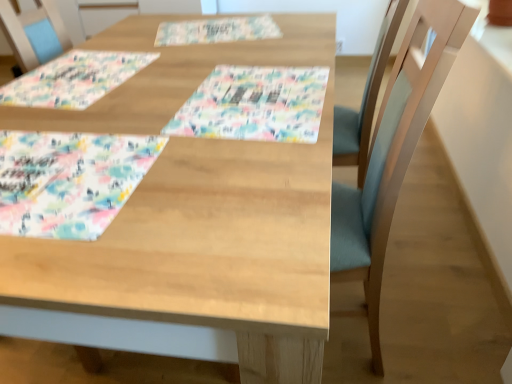
The image size is (512, 384). Find the location of `pastel floral fabric placemat at upper left, acting as the 2th place mat starting from the front`. pastel floral fabric placemat at upper left, acting as the 2th place mat starting from the front is located at coordinates (74, 79).

Measure the distance between floral paper placemat at upper center, which is the first place mat from top to bottom, and camera.

The distance of floral paper placemat at upper center, which is the first place mat from top to bottom, from camera is 1.44 meters.

Measure the distance between point (274,115) and camera.

Point (274,115) and camera are 93.80 centimeters apart.

This screenshot has width=512, height=384. What are the coordinates of `wooden table at center` in the screenshot? It's located at (198, 213).

Relative to floral paper placemat at upper center, which is counted as the third place mat, starting from the front, is pastel floral fabric placemat at lower left, which is the 1th place mat in front-to-back order, in front or behind?

pastel floral fabric placemat at lower left, which is the 1th place mat in front-to-back order, is in front of floral paper placemat at upper center, which is counted as the third place mat, starting from the front.

From a real-world perspective, relative to floral paper placemat at upper center, which is the first place mat from top to bottom, is pastel floral fabric placemat at lower left, which is the 1th place mat from bottom to top, vertically above or below?

From a real-world perspective, pastel floral fabric placemat at lower left, which is the 1th place mat from bottom to top, is physically above floral paper placemat at upper center, which is the first place mat from top to bottom.

This screenshot has height=384, width=512. There is a pastel floral fabric placemat at lower left, which is the 1th place mat from bottom to top. In order to click on the 2nd place mat above it (from the image's perspective) in this screenshot , I will do `click(217, 30)`.

From a real-world perspective, which is physically below, floral paper placemat at upper center, which is counted as the 1th place mat, starting from the back, or wooden table at center?

wooden table at center.

Would you say floral paper placemat at upper center, which is the first place mat from top to bottom, is to the left or to the right of wooden table at center in the picture?

In the image, floral paper placemat at upper center, which is the first place mat from top to bottom, appears on the right side of wooden table at center.

From the image's perspective, which is above, floral paper placemat at upper center, which is counted as the third place mat, starting from the front, or wooden table at center?

floral paper placemat at upper center, which is counted as the third place mat, starting from the front.

Is floral paper placemat at upper center, which is counted as the 1th place mat, starting from the back, taller than pastel floral fabric placemat at lower left, which is the 1th place mat from bottom to top?

In fact, floral paper placemat at upper center, which is counted as the 1th place mat, starting from the back, may be shorter than pastel floral fabric placemat at lower left, which is the 1th place mat from bottom to top.

In the image, is floral paper placemat at upper center, which is counted as the 1th place mat, starting from the back, on the left side or the right side of pastel floral fabric placemat at lower left, which is the 1th place mat from bottom to top?

From the image, it's evident that floral paper placemat at upper center, which is counted as the 1th place mat, starting from the back, is to the right of pastel floral fabric placemat at lower left, which is the 1th place mat from bottom to top.

Is floral paper placemat at upper center, which is counted as the third place mat, starting from the front, turned away from pastel floral fabric placemat at lower left, which ranks as the 3th place mat in back-to-front order?

No, floral paper placemat at upper center, which is counted as the third place mat, starting from the front, is not facing away from pastel floral fabric placemat at lower left, which ranks as the 3th place mat in back-to-front order.

Considering the sizes of floral paper placemat at upper center, the 3th place mat from the bottom, and pastel floral fabric placemat at lower left, which ranks as the 3th place mat in back-to-front order, in the image, is floral paper placemat at upper center, the 3th place mat from the bottom, wider or thinner than pastel floral fabric placemat at lower left, which ranks as the 3th place mat in back-to-front order,?

Clearly, floral paper placemat at upper center, the 3th place mat from the bottom, has less width compared to pastel floral fabric placemat at lower left, which ranks as the 3th place mat in back-to-front order.

From a real-world perspective, which object stands above the other?

In real-world perspective, pastel floral fabric placemat at upper left, acting as the 2th place mat starting from the front, is above.

From the image's perspective, count 2nd place mats upward from the wooden table at center and point to it. Please provide its 2D coordinates.

[(74, 79)]

From their relative heights in the image, would you say wooden table at center is taller or shorter than pastel floral fabric placemat at upper left, which ranks as the second place mat in back-to-front order?

In the image, wooden table at center appears to be taller than pastel floral fabric placemat at upper left, which ranks as the second place mat in back-to-front order.

Considering the sizes of wooden table at center and pastel floral fabric placemat at upper left, which ranks as the second place mat in back-to-front order, in the image, is wooden table at center bigger or smaller than pastel floral fabric placemat at upper left, which ranks as the second place mat in back-to-front order,?

In the image, wooden table at center appears to be larger than pastel floral fabric placemat at upper left, which ranks as the second place mat in back-to-front order.

From the image's perspective, is pastel floral fabric placemat at upper left, which ranks as the second place mat in back-to-front order, above or below pastel floral fabric placemat at lower left, the 3th place mat from the top?

Based on their image positions, pastel floral fabric placemat at upper left, which ranks as the second place mat in back-to-front order, is located above pastel floral fabric placemat at lower left, the 3th place mat from the top.

Between pastel floral fabric placemat at upper left, marked as the second place mat in a top-to-bottom arrangement, and pastel floral fabric placemat at lower left, which is the 1th place mat from bottom to top, which one has larger width?

pastel floral fabric placemat at lower left, which is the 1th place mat from bottom to top.

Does pastel floral fabric placemat at upper left, the second place mat in the bottom-to-top sequence, turn towards pastel floral fabric placemat at lower left, the 3th place mat from the top?

Yes, pastel floral fabric placemat at upper left, the second place mat in the bottom-to-top sequence, is oriented towards pastel floral fabric placemat at lower left, the 3th place mat from the top.

Between pastel floral fabric placemat at upper left, which ranks as the second place mat in back-to-front order, and pastel floral fabric placemat at lower left, which is the 1th place mat in front-to-back order, which one has smaller size?

pastel floral fabric placemat at lower left, which is the 1th place mat in front-to-back order.

Could you tell me if pastel floral fabric placemat at lower left, which is the 1th place mat in front-to-back order, is facing wooden table at center?

Yes, pastel floral fabric placemat at lower left, which is the 1th place mat in front-to-back order, is facing wooden table at center.

Considering the points (40, 188) and (261, 342), which point is behind, point (40, 188) or point (261, 342)?

The point (40, 188) is farther from the camera.

From the image's perspective, which is above, pastel floral fabric placemat at lower left, which ranks as the 3th place mat in back-to-front order, or wooden table at center?

pastel floral fabric placemat at lower left, which ranks as the 3th place mat in back-to-front order, is shown above in the image.

Would you say wooden table at center is outside pastel floral fabric placemat at lower left, which is the 1th place mat from bottom to top?

Indeed, wooden table at center is completely outside pastel floral fabric placemat at lower left, which is the 1th place mat from bottom to top.

Find the location of a particular element. The image size is (512, 384). the 1st place mat above the wooden table at center (from the image's perspective) is located at coordinates (69, 181).

Considering the positions of point (247, 274) and point (96, 154), is point (247, 274) closer or farther from the camera than point (96, 154)?

Point (247, 274).

From the image's perspective, is wooden table at center located above or below pastel floral fabric placemat at lower left, which ranks as the 3th place mat in back-to-front order?

wooden table at center is below pastel floral fabric placemat at lower left, which ranks as the 3th place mat in back-to-front order.

The image size is (512, 384). I want to click on the 2nd place mat positioned below the floral paper placemat at upper center, the 3th place mat from the bottom (from the image's perspective), so click(x=69, y=181).

Starting from the wooden table at center, which place mat is the 3rd one behind? Please provide its 2D coordinates.

[(217, 30)]

Based on their spatial positions, is floral paper placemat at upper center, which is counted as the third place mat, starting from the front, or watercolor fabric placemat at center closer to pastel floral fabric placemat at upper left, the second place mat in the bottom-to-top sequence?

The object closer to pastel floral fabric placemat at upper left, the second place mat in the bottom-to-top sequence, is floral paper placemat at upper center, which is counted as the third place mat, starting from the front.

When comparing their distances from pastel floral fabric placemat at upper left, which ranks as the second place mat in back-to-front order, does pastel floral fabric placemat at lower left, which ranks as the 3th place mat in back-to-front order, or wooden table at center seem further?

pastel floral fabric placemat at lower left, which ranks as the 3th place mat in back-to-front order, lies further to pastel floral fabric placemat at upper left, which ranks as the second place mat in back-to-front order, than the other object.

Looking at the image, which one is located further to floral paper placemat at upper center, the 3th place mat from the bottom, watercolor fabric placemat at center or pastel floral fabric placemat at upper left, the second place mat in the bottom-to-top sequence?

The object further to floral paper placemat at upper center, the 3th place mat from the bottom, is watercolor fabric placemat at center.

Which object lies nearer to the anchor point pastel floral fabric placemat at lower left, which ranks as the 3th place mat in back-to-front order, watercolor fabric placemat at center or wooden table at center?

wooden table at center.

Based on their spatial positions, is pastel floral fabric placemat at upper left, marked as the second place mat in a top-to-bottom arrangement, or pastel floral fabric placemat at lower left, which is the 1th place mat in front-to-back order, closer to watercolor fabric placemat at center?

pastel floral fabric placemat at lower left, which is the 1th place mat in front-to-back order, lies closer to watercolor fabric placemat at center than the other object.

Looking at the image, which one is located further to pastel floral fabric placemat at lower left, the 3th place mat from the top, wooden table at center or watercolor fabric placemat at center?

watercolor fabric placemat at center.

Based on their spatial positions, is pastel floral fabric placemat at upper left, which ranks as the second place mat in back-to-front order, or watercolor fabric placemat at center further from pastel floral fabric placemat at lower left, which ranks as the 3th place mat in back-to-front order?

Among the two, pastel floral fabric placemat at upper left, which ranks as the second place mat in back-to-front order, is located further to pastel floral fabric placemat at lower left, which ranks as the 3th place mat in back-to-front order.

Which object lies nearer to the anchor point pastel floral fabric placemat at lower left, which is the 1th place mat in front-to-back order, watercolor fabric placemat at center or pastel floral fabric placemat at upper left, acting as the 2th place mat starting from the front?

Among the two, watercolor fabric placemat at center is located nearer to pastel floral fabric placemat at lower left, which is the 1th place mat in front-to-back order.

Locate an element on the screen. Image resolution: width=512 pixels, height=384 pixels. tablecloth located between wooden table at center and pastel floral fabric placemat at upper left, the second place mat in the bottom-to-top sequence, in the depth direction is located at coordinates (255, 104).

You are a GUI agent. You are given a task and a screenshot of the screen. Output one action in this format:
    pyautogui.click(x=<x>, y=<y>)
    Task: Click on the tablecloth between wooden table at center and floral paper placemat at upper center, the 3th place mat from the bottom, from front to back
    The image size is (512, 384).
    Given the screenshot: What is the action you would take?
    pyautogui.click(x=255, y=104)

Identify the location of place mat positioned between wooden table at center and pastel floral fabric placemat at upper left, marked as the second place mat in a top-to-bottom arrangement, from near to far. (69, 181).

Where is `table located between pastel floral fabric placemat at lower left, the 3th place mat from the top, and watercolor fabric placemat at center in the left-right direction`? This screenshot has height=384, width=512. table located between pastel floral fabric placemat at lower left, the 3th place mat from the top, and watercolor fabric placemat at center in the left-right direction is located at coordinates (198, 213).